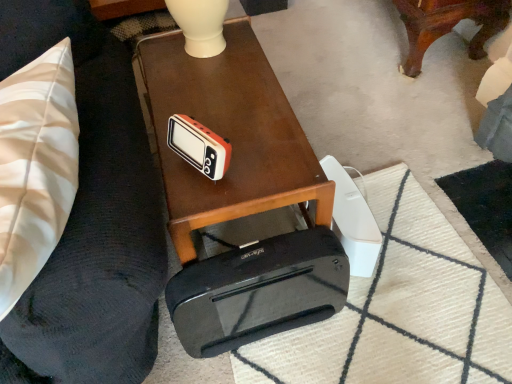
This screenshot has width=512, height=384. What do you see at coordinates (258, 291) in the screenshot?
I see `black plastic cassette at lower center` at bounding box center [258, 291].

The width and height of the screenshot is (512, 384). What are the coordinates of `wooden table at center` in the screenshot? It's located at (229, 135).

What do you see at coordinates (399, 309) in the screenshot? The height and width of the screenshot is (384, 512). I see `black rubber mat at lower center` at bounding box center [399, 309].

Locate an element on the screen. Image resolution: width=512 pixels, height=384 pixels. orange matte clock at center is located at coordinates (199, 146).

Which object is positioned more to the right, black rubber mat at lower center or black plastic printer at lower center?

black rubber mat at lower center is more to the right.

Is black rubber mat at lower center inside or outside of black plastic printer at lower center?

black rubber mat at lower center lies outside black plastic printer at lower center.

From a real-world perspective, is black rubber mat at lower center physically below black plastic printer at lower center?

Yes.

From the image's perspective, is black rubber mat at lower center above black plastic printer at lower center?

No, from the image's perspective, black rubber mat at lower center is not on top of black plastic printer at lower center.

Does black plastic cassette at lower center lie in front of orange matte clock at center?

No, black plastic cassette at lower center is further to the viewer.

Is black plastic cassette at lower center outside of orange matte clock at center?

Yes.

Considering the relative sizes of black plastic cassette at lower center and orange matte clock at center in the image provided, is black plastic cassette at lower center smaller than orange matte clock at center?

No, black plastic cassette at lower center is not smaller than orange matte clock at center.

Can you confirm if black plastic cassette at lower center is wider than orange matte clock at center?

Indeed, black plastic cassette at lower center has a greater width compared to orange matte clock at center.

Consider the image. Considering the relative sizes of black plastic printer at lower center and black rubber mat at lower center in the image provided, is black plastic printer at lower center taller than black rubber mat at lower center?

Indeed, black plastic printer at lower center has a greater height compared to black rubber mat at lower center.

Which is behind, point (154, 252) or point (378, 314)?

The point (378, 314) is farther from the camera.

Image resolution: width=512 pixels, height=384 pixels. Find the location of `mat lying below the black plastic printer at lower center (from the image's perspective)`. mat lying below the black plastic printer at lower center (from the image's perspective) is located at coordinates (399, 309).

Which is correct: black plastic printer at lower center is inside black rubber mat at lower center, or outside of it?

black plastic printer at lower center lies outside black rubber mat at lower center.

Which object is positioned more to the left, orange matte clock at center or wooden table at center?

Positioned to the left is orange matte clock at center.

Is point (172, 139) more distant than point (268, 70)?

No.

Is wooden table at center inside orange matte clock at center?

No.

Which object is further away from the camera, orange matte clock at center or wooden table at center?

wooden table at center is further away from the camera.

Is the depth of black rubber mat at lower center greater than that of orange matte clock at center?

Yes, black rubber mat at lower center is behind orange matte clock at center.

Which is behind, point (373, 183) or point (183, 150)?

The point (373, 183) is farther from the camera.

Find the location of a particular element. The width and height of the screenshot is (512, 384). mat that is below the orange matte clock at center (from the image's perspective) is located at coordinates (399, 309).

How far apart are black rubber mat at lower center and orange matte clock at center?

A distance of 28.65 inches exists between black rubber mat at lower center and orange matte clock at center.

Where is `gadget below the black plastic printer at lower center (from a real-world perspective)`? This screenshot has width=512, height=384. gadget below the black plastic printer at lower center (from a real-world perspective) is located at coordinates (199, 146).

Is the depth of black plastic printer at lower center greater than that of orange matte clock at center?

That is False.

From a real-world perspective, which object rests below the other?

From a 3D spatial view, orange matte clock at center is below.

Can you confirm if black plastic printer at lower center is bigger than orange matte clock at center?

Indeed, black plastic printer at lower center has a larger size compared to orange matte clock at center.

Which object is wider, orange matte clock at center or black plastic printer at lower center?

black plastic printer at lower center is wider.

Is orange matte clock at center facing away from black plastic printer at lower center?

No, black plastic printer at lower center is not at the back of orange matte clock at center.

How different are the orientations of orange matte clock at center and black plastic printer at lower center in degrees?

The angle between the facing direction of orange matte clock at center and the facing direction of black plastic printer at lower center is 46.3 degrees.

At what (x,y) coordinates should I click in order to perform the action: click on mat behind the black plastic printer at lower center. Please return your answer as a coordinate pair (x, y). The width and height of the screenshot is (512, 384). Looking at the image, I should click on (399, 309).

Locate an element on the screen. The height and width of the screenshot is (384, 512). cassette on the right of orange matte clock at center is located at coordinates (258, 291).

Based on their spatial positions, is black plastic cassette at lower center or wooden table at center further from orange matte clock at center?

black plastic cassette at lower center is further to orange matte clock at center.

Estimate the real-world distances between objects in this image. Which object is closer to black plastic cassette at lower center, orange matte clock at center or black plastic printer at lower center?

Based on the image, black plastic printer at lower center appears to be nearer to black plastic cassette at lower center.

Estimate the real-world distances between objects in this image. Which object is closer to black plastic printer at lower center, wooden table at center or black plastic cassette at lower center?

wooden table at center is closer to black plastic printer at lower center.

From the image, which object appears to be nearer to wooden table at center, black plastic printer at lower center or black plastic cassette at lower center?

black plastic printer at lower center lies closer to wooden table at center than the other object.

Considering their positions, is black plastic printer at lower center positioned further to wooden table at center than orange matte clock at center?

black plastic printer at lower center is positioned further to the anchor wooden table at center.

When comparing their distances from black plastic printer at lower center, does black plastic cassette at lower center or wooden table at center seem further?

black plastic cassette at lower center.

Based on their spatial positions, is black plastic printer at lower center or black plastic cassette at lower center further from black rubber mat at lower center?

black plastic printer at lower center lies further to black rubber mat at lower center than the other object.

Looking at this image, which object lies nearer to the anchor point black plastic cassette at lower center, black rubber mat at lower center or wooden table at center?

Among the two, black rubber mat at lower center is located nearer to black plastic cassette at lower center.

This screenshot has height=384, width=512. Find the location of `gadget that lies between wooden table at center and black plastic cassette at lower center from top to bottom`. gadget that lies between wooden table at center and black plastic cassette at lower center from top to bottom is located at coordinates (199, 146).

Find the location of a particular element. This screenshot has width=512, height=384. gadget between black plastic printer at lower center and black rubber mat at lower center from left to right is located at coordinates (199, 146).

What are the coordinates of `cassette between wooden table at center and black rubber mat at lower center in the up-down direction` in the screenshot? It's located at (258, 291).

The height and width of the screenshot is (384, 512). I want to click on cassette between black plastic printer at lower center and black rubber mat at lower center, so click(258, 291).